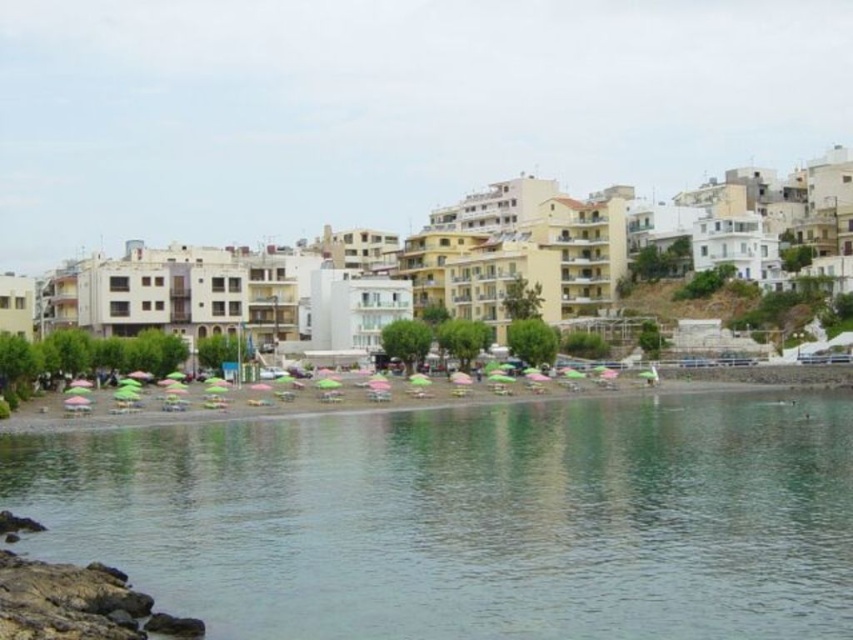
Is clear water at lower center below green umbrellas at lower center?

Yes, clear water at lower center is below green umbrellas at lower center.

Who is taller, clear water at lower center or green umbrellas at lower center?

clear water at lower center is taller.

Is point (55, 536) farther from viewer compared to point (844, 365)?

No, (55, 536) is closer to viewer.

Locate an element on the screen. clear water at lower center is located at coordinates (469, 518).

Does clear water at lower center have a smaller size compared to beige stucco hotel at center?

Yes, clear water at lower center is smaller than beige stucco hotel at center.

This screenshot has height=640, width=853. I want to click on clear water at lower center, so pos(469,518).

Between point (485, 547) and point (844, 157), which one is positioned behind?

The point (844, 157) is more distant.

Locate an element on the screen. This screenshot has height=640, width=853. clear water at lower center is located at coordinates (469, 518).

Who is more distant from viewer, (55, 324) or (335, 403)?

The point (55, 324) is behind.

Can you confirm if beige stucco hotel at center is positioned below green umbrellas at lower center?

Incorrect, beige stucco hotel at center is not positioned below green umbrellas at lower center.

Does point (351, 356) come closer to viewer compared to point (61, 428)?

That is False.

Where is `beige stucco hotel at center`? Image resolution: width=853 pixels, height=640 pixels. beige stucco hotel at center is located at coordinates (569, 252).